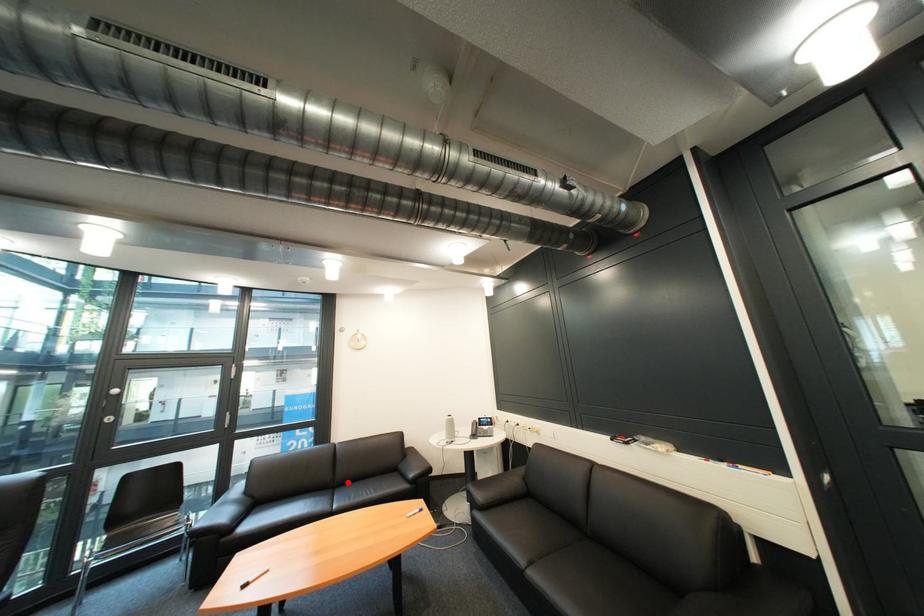
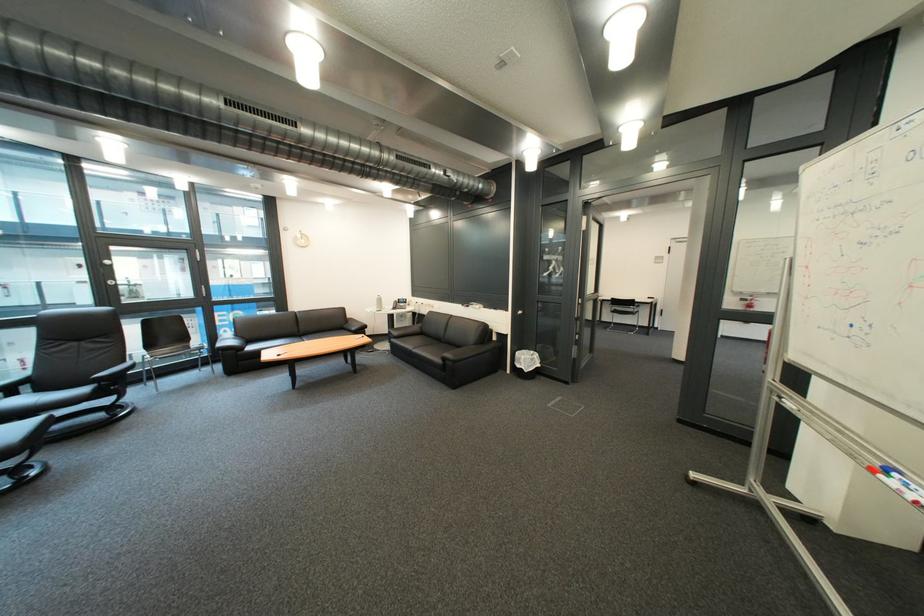
Question: I am providing you with two images of the same scene from different viewpoints. Given a red point in image1, look at the same physical point in image2. Is it:

Choices:
 (A) Closer to the viewpoint
 (B) Farther from the viewpoint

Answer: (B)